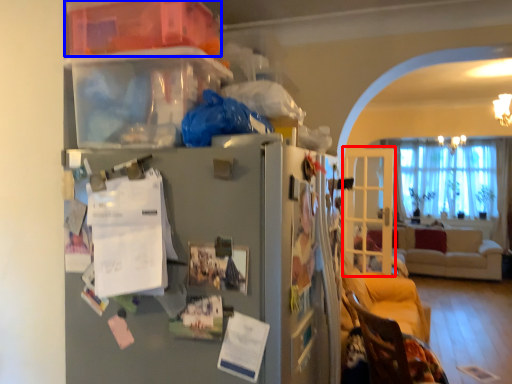
Question: Which of the following is the farthest to the observer, glass door (highlighted by a red box) or storage box (highlighted by a blue box)?

Choices:
 (A) glass door
 (B) storage box

Answer: (A)